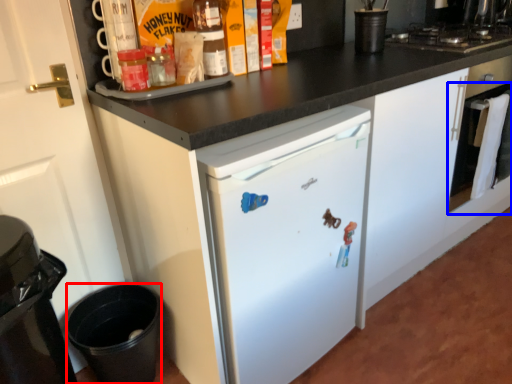
Question: Which object appears farthest to the camera in this image, appliance (highlighted by a red box) or oven (highlighted by a blue box)?

Choices:
 (A) appliance
 (B) oven

Answer: (B)